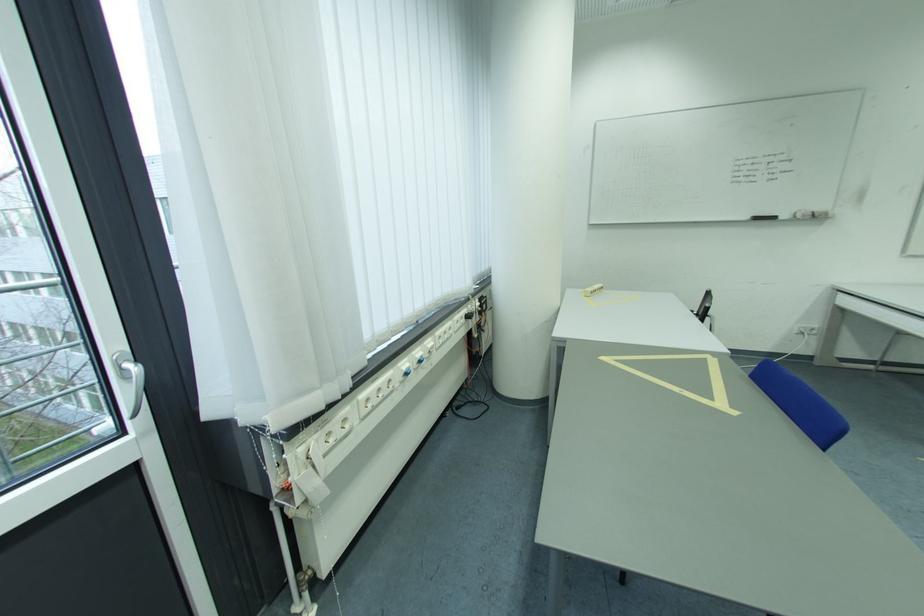
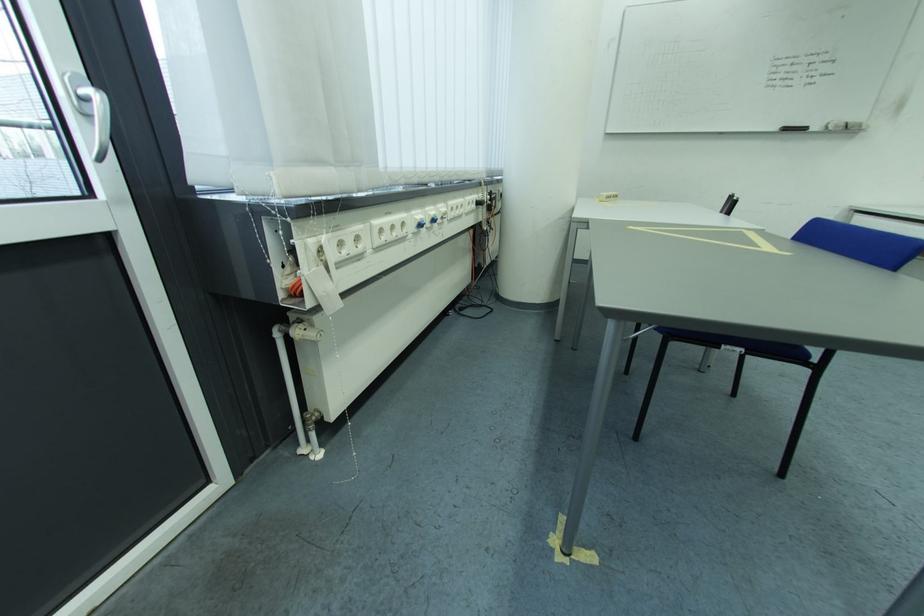
In the second image, find the point that corresponds to (x=493, y=309) in the first image.

(503, 205)